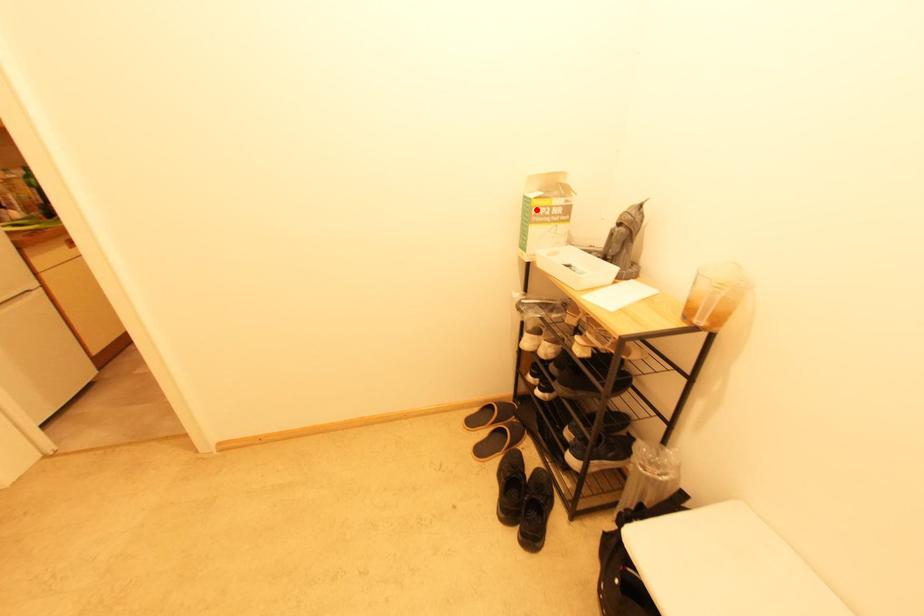
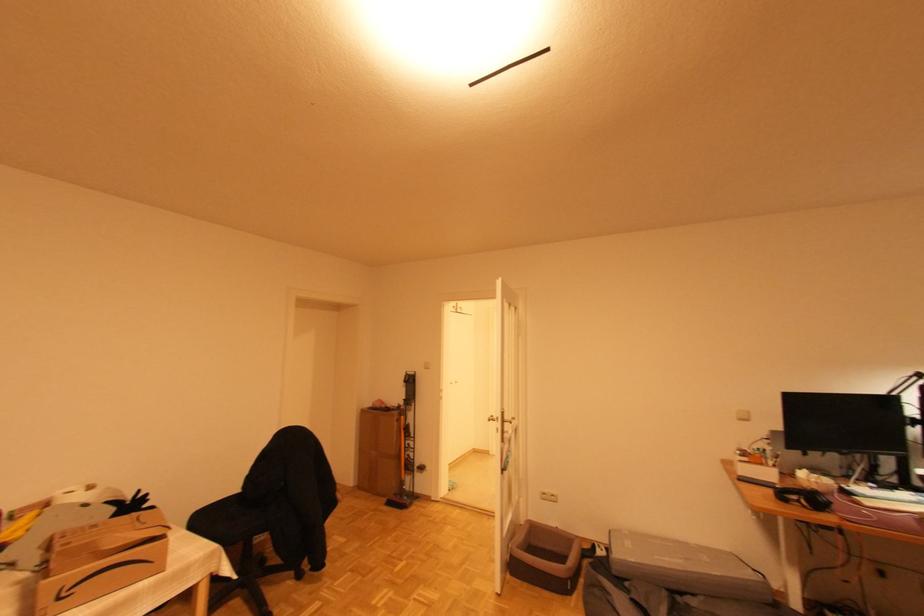
Question: I am providing you with two images of the same scene from different viewpoints. A red point is marked on the first image. Is the red point's position out of view in image 2?

Choices:
 (A) Yes
 (B) No

Answer: (A)